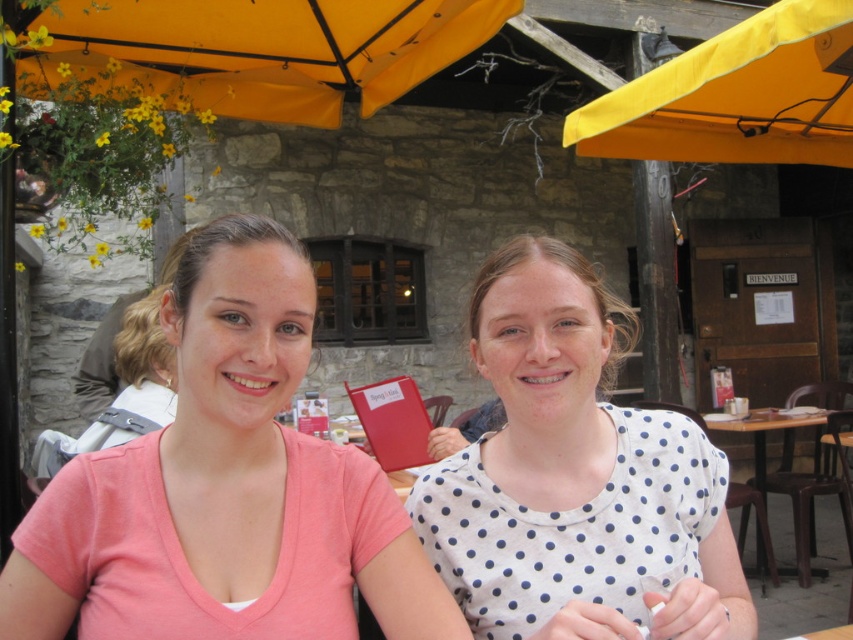
Who is positioned more to the left, matte yellow umbrella at upper left or yellow fabric canopy at upper center?

Positioned to the left is matte yellow umbrella at upper left.

Find the location of a particular element. The height and width of the screenshot is (640, 853). matte yellow umbrella at upper left is located at coordinates (258, 51).

Find the location of `matte yellow umbrella at upper left`. matte yellow umbrella at upper left is located at coordinates (258, 51).

Does white dotted shirt at center appear under wooden table at lower right?

Incorrect, white dotted shirt at center is not positioned below wooden table at lower right.

Is white dotted shirt at center behind wooden table at lower right?

No, it is in front of wooden table at lower right.

Locate an element on the screen. Image resolution: width=853 pixels, height=640 pixels. white dotted shirt at center is located at coordinates (575, 480).

Does white dotted shirt at center appear on the right side of yellow fabric canopy at upper center?

No, white dotted shirt at center is not to the right of yellow fabric canopy at upper center.

Does white dotted shirt at center appear on the left side of yellow fabric canopy at upper center?

Correct, you'll find white dotted shirt at center to the left of yellow fabric canopy at upper center.

At what (x,y) coordinates should I click in order to perform the action: click on white dotted shirt at center. Please return your answer as a coordinate pair (x, y). This screenshot has height=640, width=853. Looking at the image, I should click on (575, 480).